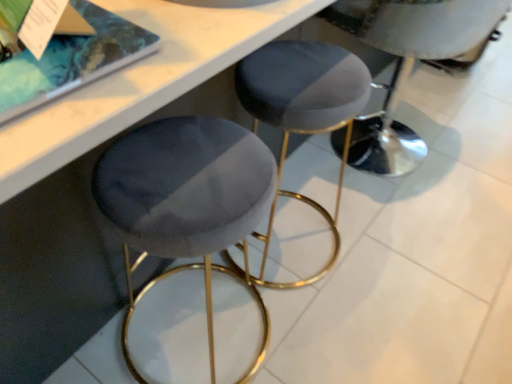
The width and height of the screenshot is (512, 384). Find the location of `vacant space in velvet grey stool at center (from a real-world perspective)`. vacant space in velvet grey stool at center (from a real-world perspective) is located at coordinates (397, 164).